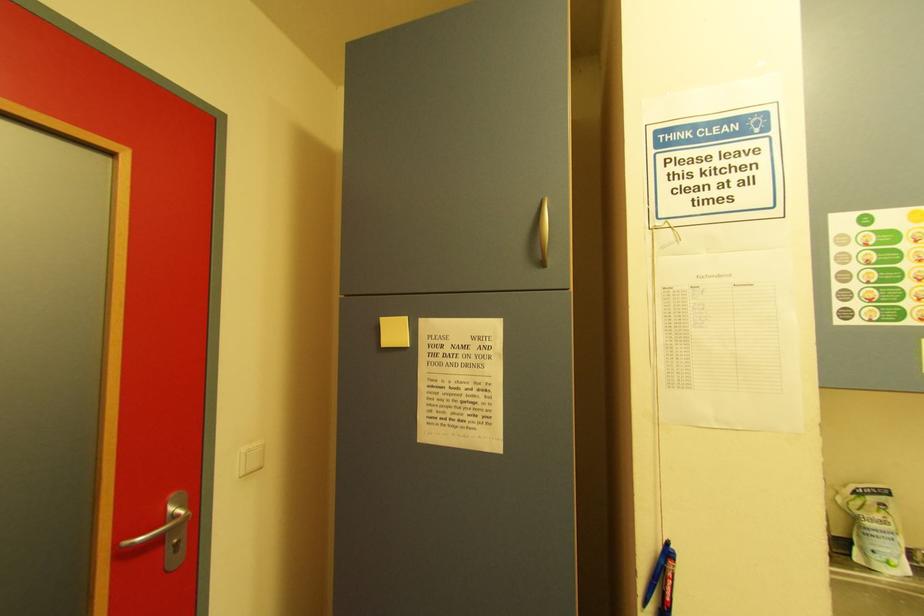
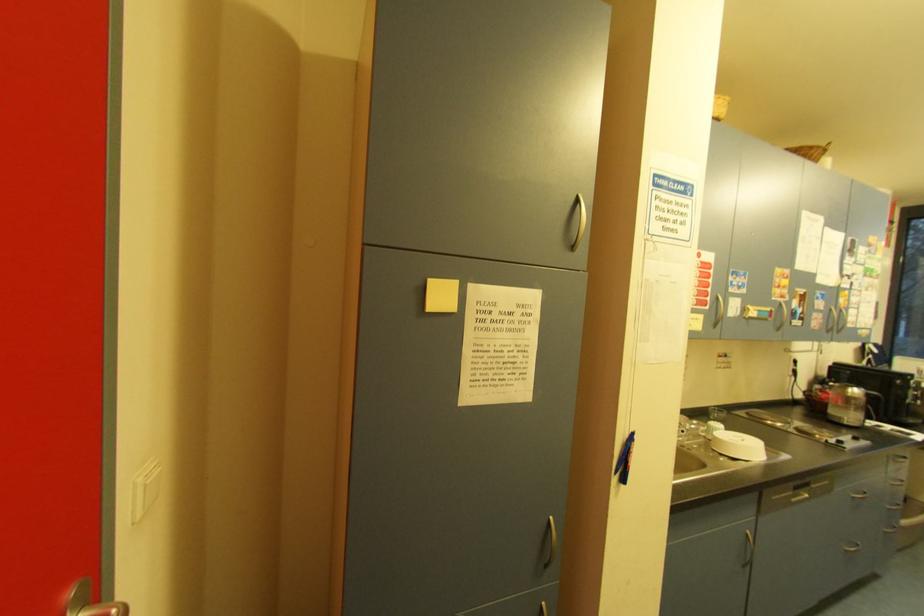
Question: The camera is either moving clockwise (left) or counter-clockwise (right) around the object. The first image is from the beginning of the video and the second image is from the end. Is the camera moving left or right when shooting the video?

Choices:
 (A) Left
 (B) Right

Answer: (A)